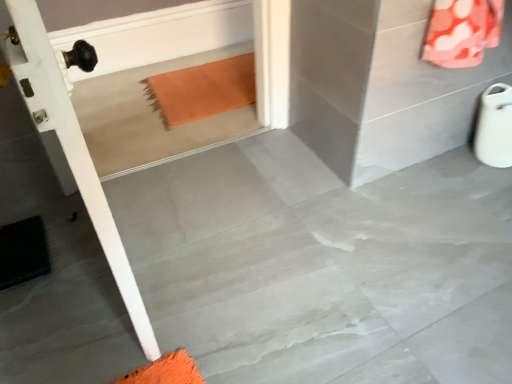
Question: Considering the relative positions of gray polished concrete at center and orange fabric at upper right in the image provided, is gray polished concrete at center to the left of orange fabric at upper right from the viewer's perspective?

Choices:
 (A) yes
 (B) no

Answer: (A)

Question: Is gray polished concrete at center at the right side of orange fabric at upper right?

Choices:
 (A) no
 (B) yes

Answer: (A)

Question: From the image's perspective, is gray polished concrete at center on orange fabric at upper right?

Choices:
 (A) yes
 (B) no

Answer: (B)

Question: Is gray polished concrete at center positioned beyond the bounds of orange fabric at upper right?

Choices:
 (A) no
 (B) yes

Answer: (B)

Question: Is gray polished concrete at center oriented towards orange fabric at upper right?

Choices:
 (A) yes
 (B) no

Answer: (B)

Question: Would you say gray polished concrete at center is inside or outside black rubber doormat at lower left?

Choices:
 (A) outside
 (B) inside

Answer: (A)

Question: Does point (359, 337) appear closer or farther from the camera than point (17, 238)?

Choices:
 (A) farther
 (B) closer

Answer: (B)

Question: Based on their sizes in the image, would you say gray polished concrete at center is bigger or smaller than black rubber doormat at lower left?

Choices:
 (A) big
 (B) small

Answer: (A)

Question: Is gray polished concrete at center wider or thinner than black rubber doormat at lower left?

Choices:
 (A) wide
 (B) thin

Answer: (A)

Question: From the image's perspective, is gray polished concrete at center above or below orange fabric at upper right?

Choices:
 (A) above
 (B) below

Answer: (B)

Question: Does point (440, 276) appear closer or farther from the camera than point (489, 11)?

Choices:
 (A) farther
 (B) closer

Answer: (A)

Question: From a real-world perspective, relative to orange fabric at upper right, is gray polished concrete at center vertically above or below?

Choices:
 (A) above
 (B) below

Answer: (B)

Question: Is gray polished concrete at center taller or shorter than orange fabric at upper right?

Choices:
 (A) short
 (B) tall

Answer: (A)

Question: Would you say orange fabric at upper right is to the left or to the right of black rubber doormat at lower left in the picture?

Choices:
 (A) left
 (B) right

Answer: (B)

Question: Is orange fabric at upper right taller or shorter than black rubber doormat at lower left?

Choices:
 (A) tall
 (B) short

Answer: (A)